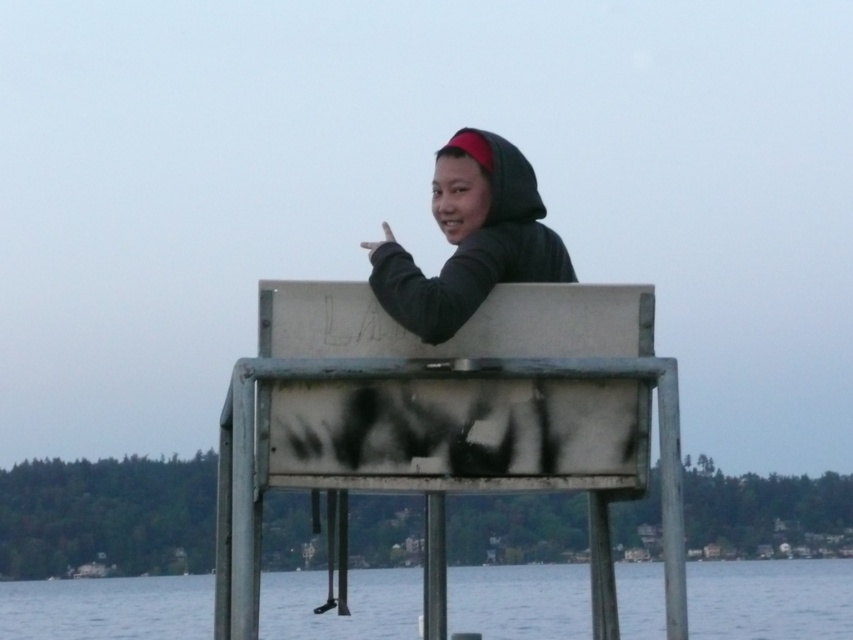
You are standing on the metallic gray dock at center and want to see the transparent water at lower center. In which direction should you look?

You should look downward because the metallic gray dock at center is located above the transparent water at lower center.